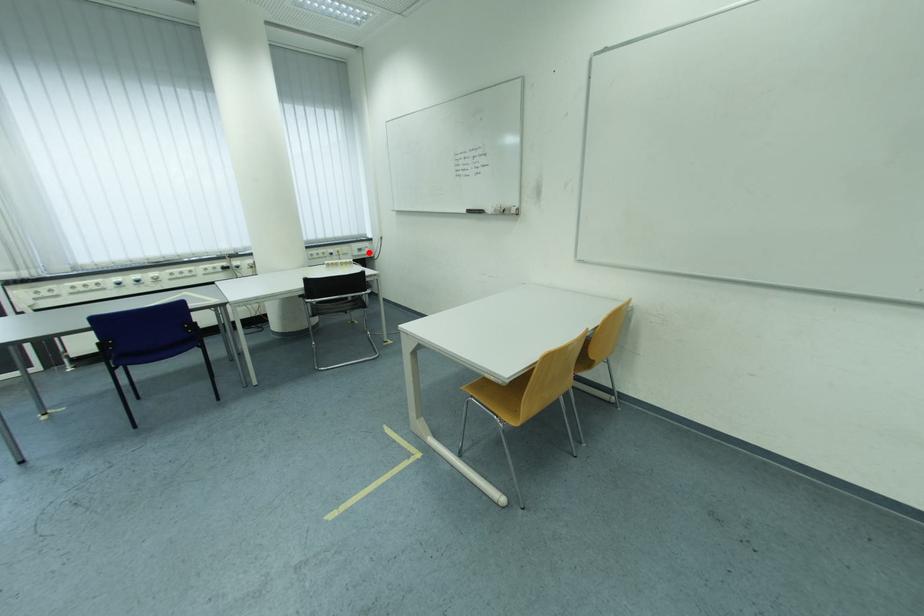
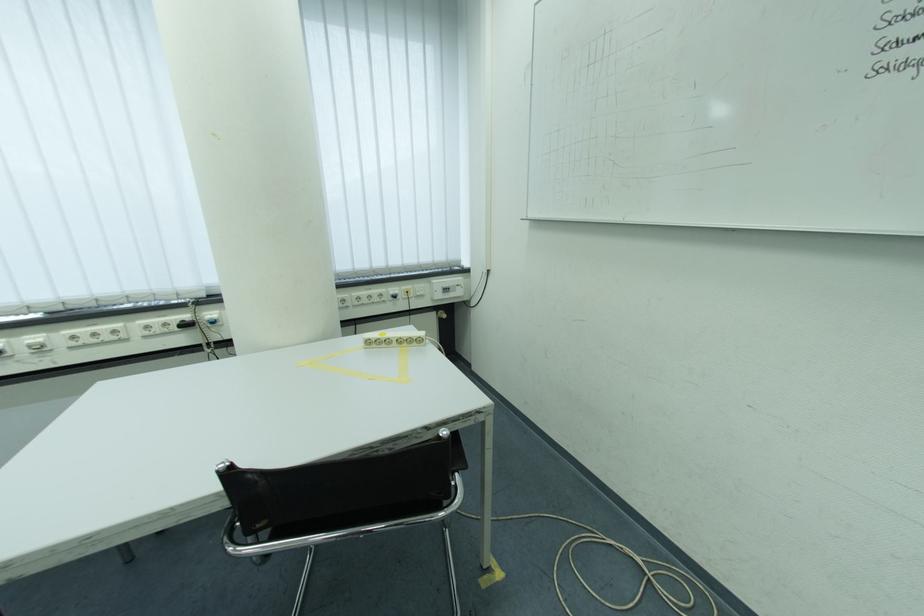
Where in the second image is the point corresponding to the highlighted location from the first image?

(455, 292)